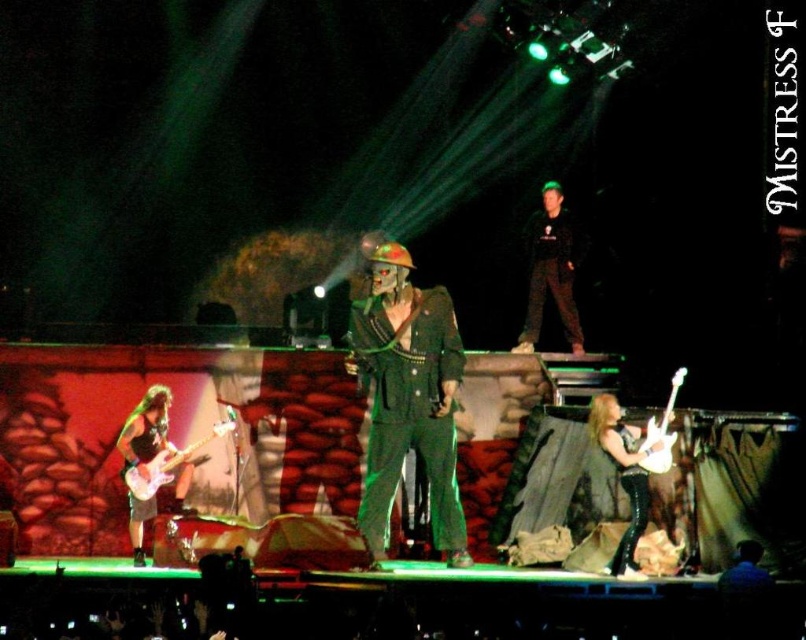
Does black matte pants at center have a larger size compared to shiny black guitar at lower left?

Indeed, black matte pants at center has a larger size compared to shiny black guitar at lower left.

Between black matte pants at center and shiny black guitar at lower left, which one appears on the left side from the viewer's perspective?

From the viewer's perspective, shiny black guitar at lower left appears more on the left side.

Is point (539, 227) positioned before point (152, 509)?

No, (539, 227) is further to viewer.

Identify the location of black matte pants at center. Image resolution: width=806 pixels, height=640 pixels. (551, 269).

Is green matte suit at center wider than black matte pants at center?

Indeed, green matte suit at center has a greater width compared to black matte pants at center.

Does point (443, 428) come closer to viewer compared to point (526, 324)?

Yes, it is.

Does point (418, 348) lie behind point (561, 189)?

No.

What are the coordinates of `green matte suit at center` in the screenshot? It's located at (408, 397).

Between shiny black guitar at lower left and glossy white electric guitar at lower left, which one has more height?

shiny black guitar at lower left

Is shiny black guitar at lower left shorter than glossy white electric guitar at lower left?

No.

This screenshot has width=806, height=640. I want to click on shiny black guitar at lower left, so click(x=146, y=429).